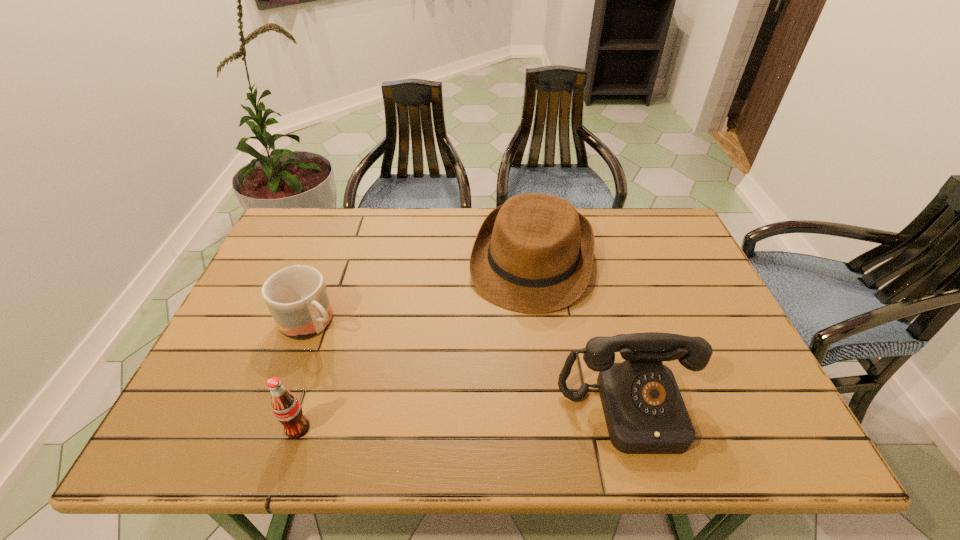
This screenshot has height=540, width=960. Find the location of `free space between the fedora and the soda`. free space between the fedora and the soda is located at coordinates (415, 345).

Find the location of a particular element. The height and width of the screenshot is (540, 960). the second closest object relative to the telephone is located at coordinates (286, 407).

Identify which object is located as the nearest to the fedora. Please provide its 2D coordinates. Your answer should be formatted as a tuple, i.e. [(x, y)], where the tuple contains the x and y coordinates of a point satisfying the conditions above.

[(644, 410)]

Identify the location of free spot that satisfies the following two spatial constraints: 1. on the back side of the soda; 2. on the left side of the fedora. Image resolution: width=960 pixels, height=540 pixels. (351, 261).

Locate an element on the screen. The height and width of the screenshot is (540, 960). free space that satisfies the following two spatial constraints: 1. on the front side of the soda; 2. on the left side of the mug is located at coordinates tap(272, 428).